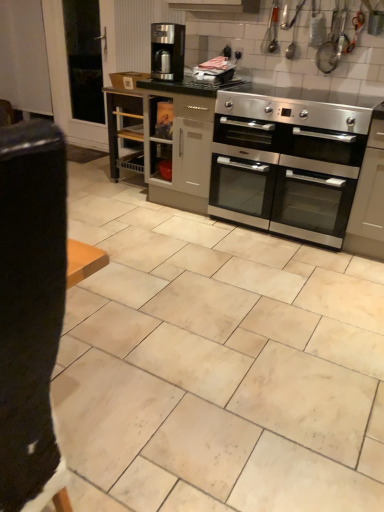
Question: Does beige matte tile at center touch satin grey cabinet at center?

Choices:
 (A) yes
 (B) no

Answer: (B)

Question: Is beige matte tile at center taller than satin grey cabinet at center?

Choices:
 (A) no
 (B) yes

Answer: (A)

Question: From the image's perspective, is beige matte tile at center over satin grey cabinet at center?

Choices:
 (A) yes
 (B) no

Answer: (B)

Question: From a real-world perspective, is beige matte tile at center below satin grey cabinet at center?

Choices:
 (A) yes
 (B) no

Answer: (A)

Question: Considering the relative sizes of beige matte tile at center and satin grey cabinet at center in the image provided, is beige matte tile at center thinner than satin grey cabinet at center?

Choices:
 (A) yes
 (B) no

Answer: (B)

Question: From the image's perspective, relative to satin black coffee maker at center, is beige matte tile at center above or below?

Choices:
 (A) above
 (B) below

Answer: (B)

Question: Considering the positions of beige matte tile at center and satin black coffee maker at center in the image, is beige matte tile at center taller or shorter than satin black coffee maker at center?

Choices:
 (A) tall
 (B) short

Answer: (B)

Question: Considering the positions of beige matte tile at center and satin black coffee maker at center in the image, is beige matte tile at center wider or thinner than satin black coffee maker at center?

Choices:
 (A) wide
 (B) thin

Answer: (A)

Question: Based on their positions, is beige matte tile at center located to the left or right of satin black coffee maker at center?

Choices:
 (A) left
 (B) right

Answer: (A)

Question: Is transparent glass door at upper left in front of or behind stainless steel oven at center in the image?

Choices:
 (A) behind
 (B) front

Answer: (A)

Question: Looking at their shapes, would you say transparent glass door at upper left is wider or thinner than stainless steel oven at center?

Choices:
 (A) wide
 (B) thin

Answer: (B)

Question: From a real-world perspective, relative to stainless steel oven at center, is transparent glass door at upper left vertically above or below?

Choices:
 (A) below
 (B) above

Answer: (A)

Question: Considering the positions of point (77, 105) and point (264, 101), is point (77, 105) closer or farther from the camera than point (264, 101)?

Choices:
 (A) farther
 (B) closer

Answer: (A)

Question: Is point (225, 114) positioned closer to the camera than point (104, 88)?

Choices:
 (A) farther
 (B) closer

Answer: (B)

Question: Visually, is stainless steel oven at center positioned to the left or to the right of satin grey cabinet at center?

Choices:
 (A) right
 (B) left

Answer: (A)